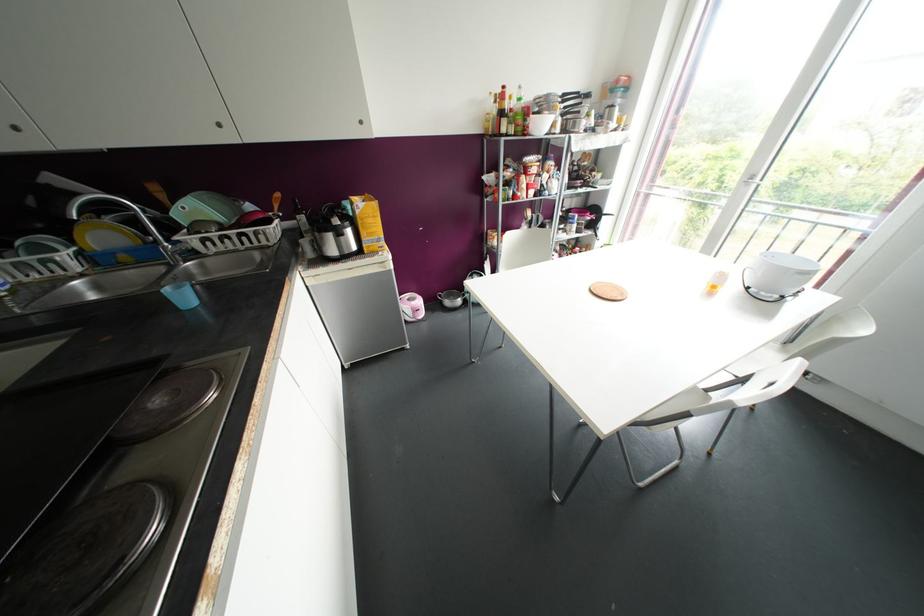
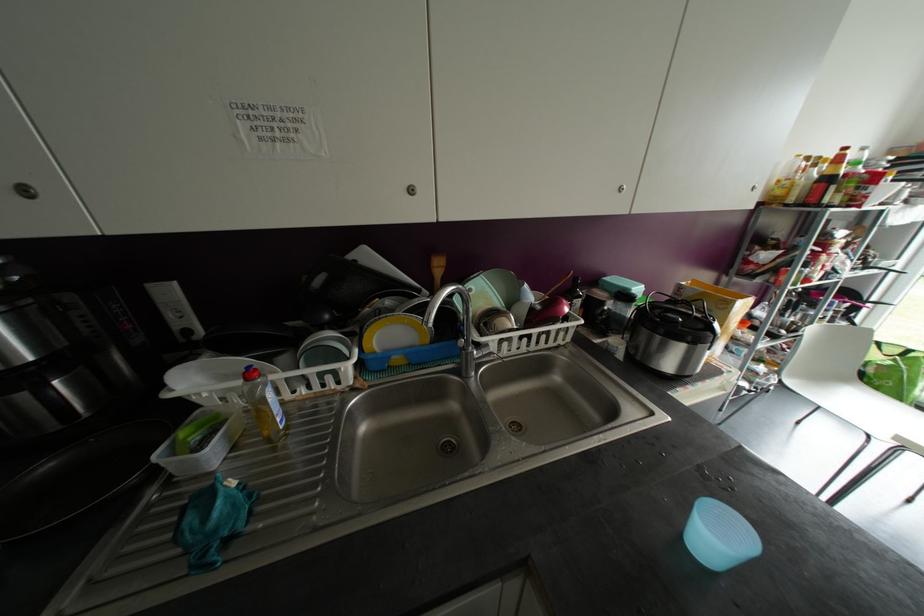
Question: Which direction would the cameraman need to move to produce the second image? Reply with the corresponding letter.

Choices:
 (A) Left
 (B) Right
 (C) Forward
 (D) Backward

Answer: (A)